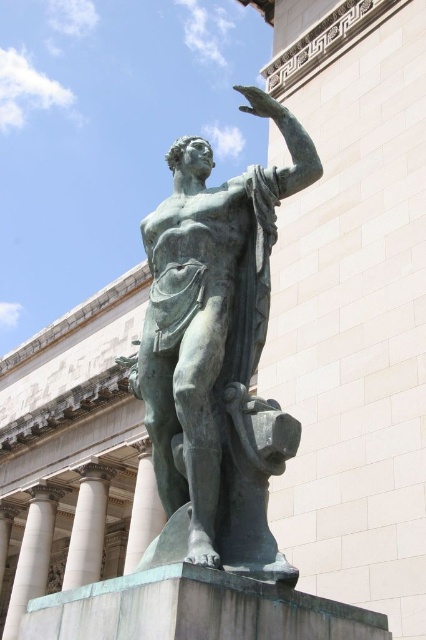
Is green patina statue at center to the left of white marble pillar at lower left from the viewer's perspective?

Incorrect, green patina statue at center is not on the left side of white marble pillar at lower left.

Between green patina statue at center and white marble pillar at lower left, which one is positioned lower?

white marble pillar at lower left is below.

The height and width of the screenshot is (640, 426). I want to click on green patina statue at center, so click(x=215, y=355).

Is green patina statue at center further to camera compared to bronze at center?

No, green patina statue at center is in front of bronze at center.

Is green patina statue at center shorter than bronze at center?

Yes.

This screenshot has height=640, width=426. What are the coordinates of `green patina statue at center` in the screenshot? It's located at (215, 355).

The height and width of the screenshot is (640, 426). What are the coordinates of `green patina statue at center` in the screenshot? It's located at (215, 355).

Does green patina statue at center appear under white marble pillar at center?

No, green patina statue at center is not below white marble pillar at center.

Which is more to the left, green patina statue at center or white marble pillar at center?

white marble pillar at center is more to the left.

Is point (268, 285) closer to viewer compared to point (83, 570)?

Yes.

The image size is (426, 640). Identify the location of green patina statue at center. (215, 355).